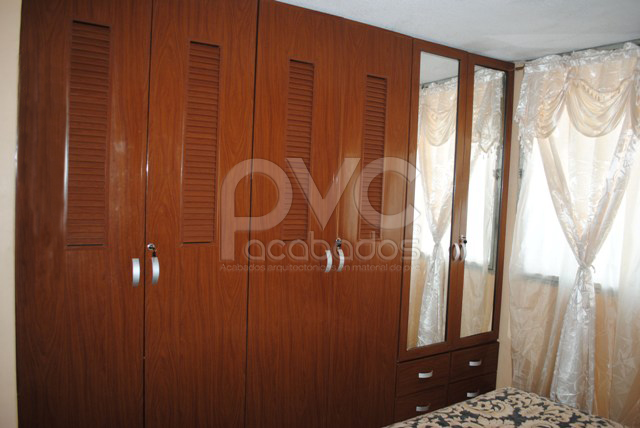
Where is `wall`? The width and height of the screenshot is (640, 428). wall is located at coordinates (507, 370), (8, 304).